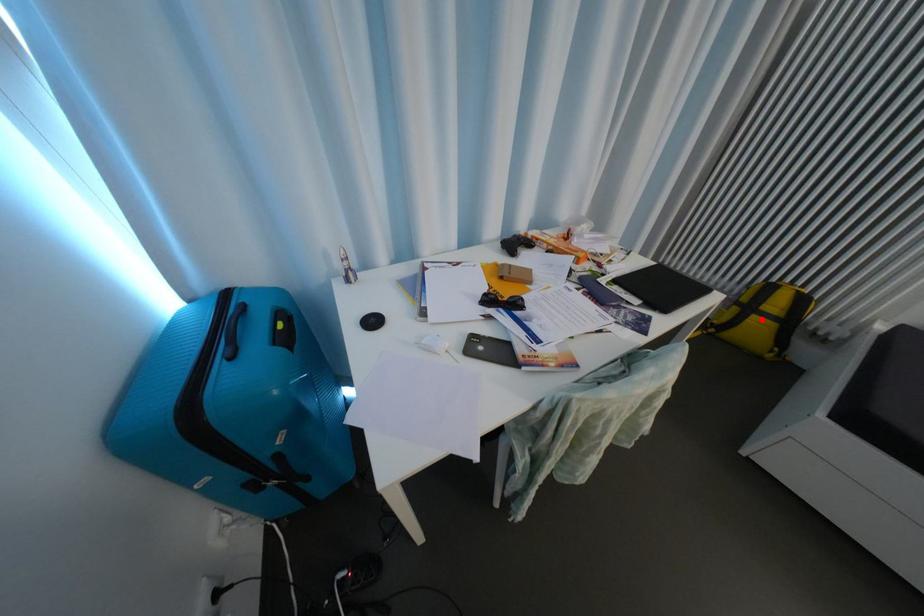
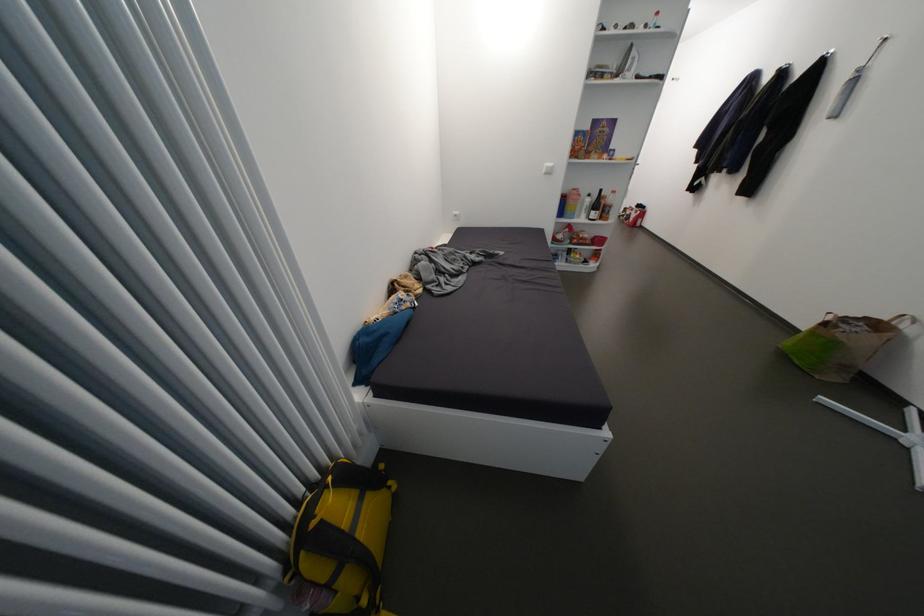
Question: I am providing you with two images of the same scene from different viewpoints. A red point is shown in image1. For the corresponding object point in image2, is it positioned nearer or farther from the camera?

Choices:
 (A) Nearer
 (B) Farther

Answer: (A)